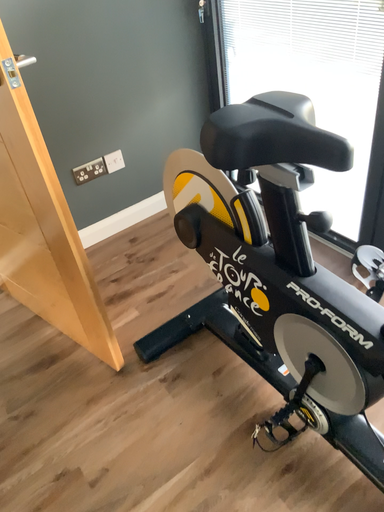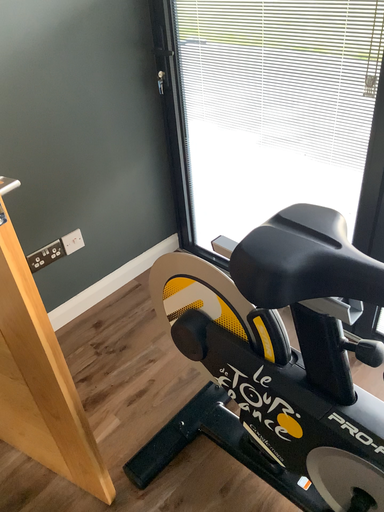
Question: Which way did the camera rotate in the video?

Choices:
 (A) rotated right
 (B) rotated left

Answer: (A)